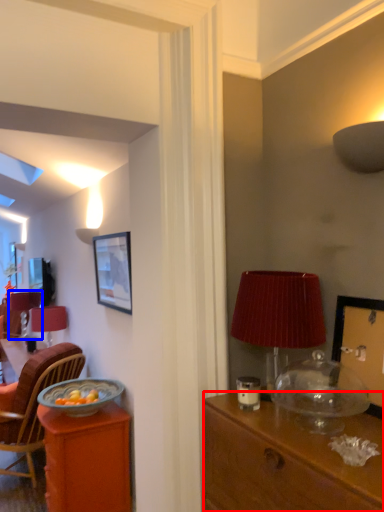
Question: Among these objects, which one is farthest to the camera, desk (highlighted by a red box) or table lamp (highlighted by a blue box)?

Choices:
 (A) desk
 (B) table lamp

Answer: (B)